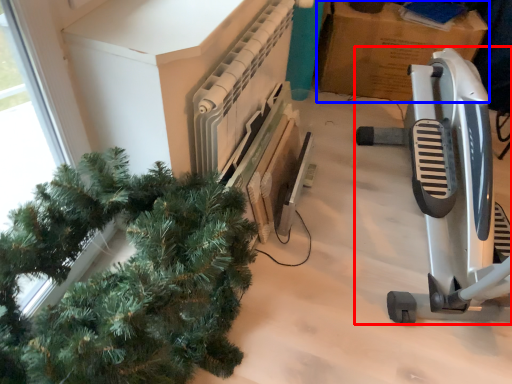
Question: Which object is closer to the camera taking this photo, job (highlighted by a red box) or cardboard box (highlighted by a blue box)?

Choices:
 (A) job
 (B) cardboard box

Answer: (A)